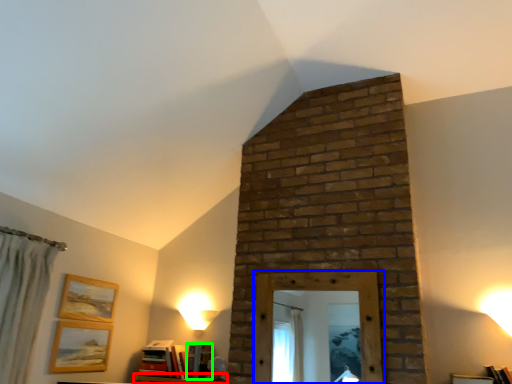
Question: Based on their relative distances, which object is farther from furniture (highlighted by a red box)? Choose from window frame (highlighted by a blue box) and book (highlighted by a green box).

Choices:
 (A) window frame
 (B) book

Answer: (A)